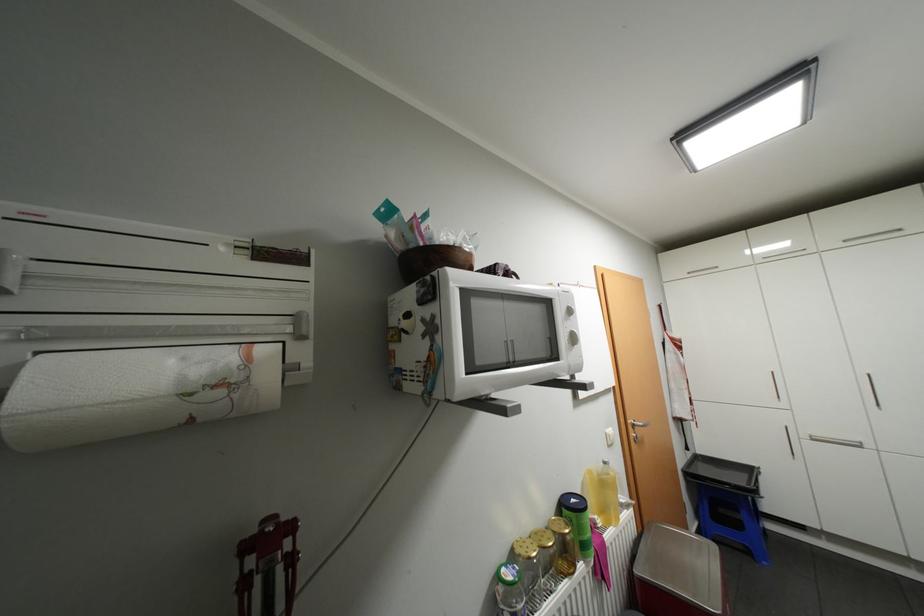
The location [136,392] corresponds to which object?

It refers to a paper towel roll.